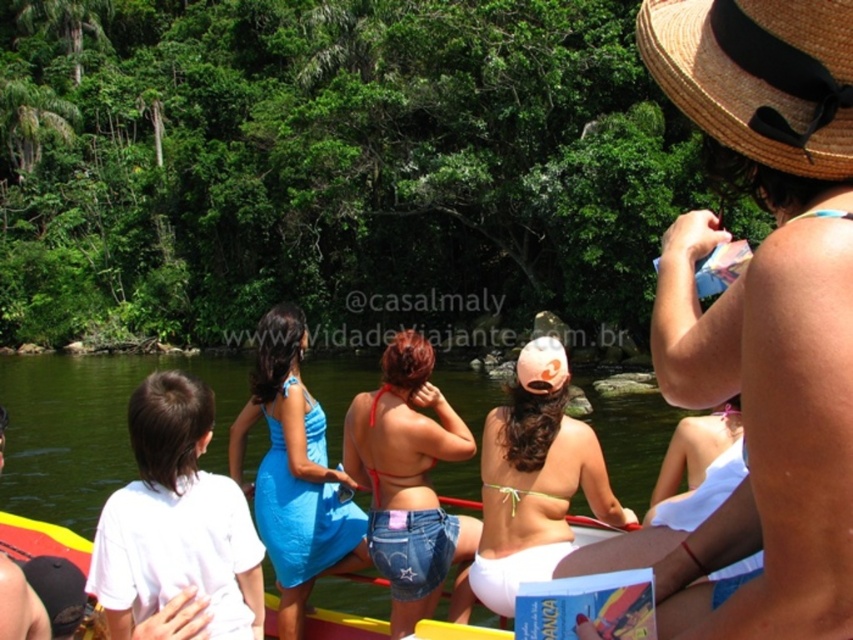
You are a GUI agent. You are given a task and a screenshot of the screen. Output one action in this format:
    pyautogui.click(x=<x>, y=<y>)
    Task: Click on the strawmaterial/texturehat at upper right
    This screenshot has height=640, width=853.
    Given the screenshot: What is the action you would take?
    pyautogui.click(x=759, y=76)

What do you see at coordinates (759, 76) in the screenshot? The height and width of the screenshot is (640, 853). I see `strawmaterial/texturehat at upper right` at bounding box center [759, 76].

Where is `strawmaterial/texturehat at upper right`? strawmaterial/texturehat at upper right is located at coordinates (759, 76).

Is white cotton shirt at center to the left of white cotton shirt at lower left from the viewer's perspective?

Incorrect, white cotton shirt at center is not on the left side of white cotton shirt at lower left.

The height and width of the screenshot is (640, 853). Describe the element at coordinates (177, 520) in the screenshot. I see `white cotton shirt at center` at that location.

Identify the location of white cotton shirt at center. (177, 520).

Which of these two, blue satin dress at center or white cotton shirt at lower left, stands taller?

With more height is blue satin dress at center.

Between blue satin dress at center and white cotton shirt at lower left, which one is positioned lower?

white cotton shirt at lower left is lower down.

Between point (334, 531) and point (9, 573), which one is positioned behind?

Point (334, 531)

The width and height of the screenshot is (853, 640). In order to click on blue satin dress at center in this screenshot , I will do `click(294, 472)`.